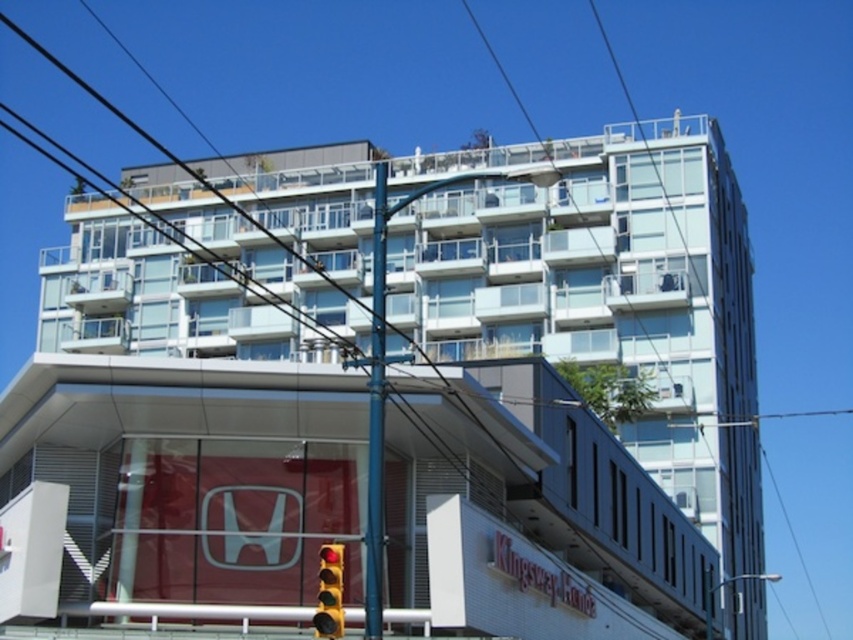
Does red glass traffic light at lower center have a smaller size compared to clear blue wire at upper center?

Indeed, red glass traffic light at lower center has a smaller size compared to clear blue wire at upper center.

Is red glass traffic light at lower center thinner than clear blue wire at upper center?

Yes.

Is point (322, 627) less distant than point (693, 422)?

Yes, it is.

This screenshot has width=853, height=640. In order to click on red glass traffic light at lower center in this screenshot , I will do `click(329, 593)`.

Can you confirm if transparent glass power line at upper center is positioned to the left of red glass traffic light at lower center?

Yes, transparent glass power line at upper center is to the left of red glass traffic light at lower center.

Which is more to the right, transparent glass power line at upper center or red glass traffic light at lower center?

From the viewer's perspective, red glass traffic light at lower center appears more on the right side.

Is point (202, 179) closer to camera compared to point (340, 582)?

No, it is not.

Find the location of a particular element. This screenshot has height=640, width=853. transparent glass power line at upper center is located at coordinates (126, 120).

Can you confirm if transparent glass building at center is bigger than clear blue wire at upper center?

Yes.

Is point (16, 412) in front of point (727, 422)?

Yes, point (16, 412) is in front of point (727, 422).

Does point (393, 554) come farther from viewer compared to point (717, 422)?

No, it is not.

Find the location of `transparent glass building at center`. transparent glass building at center is located at coordinates (573, 397).